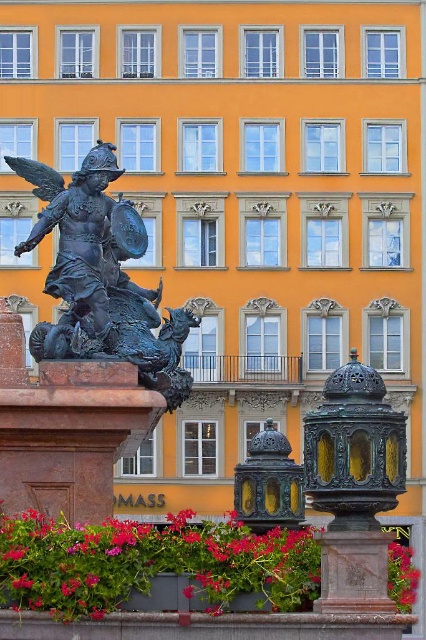
Question: Which object appears farthest from the camera in this image?

Choices:
 (A) bronze statue at left
 (B) vivid pink petals at lower center

Answer: (A)

Question: Does vivid pink petals at lower center have a smaller size compared to vivid red petals at lower right?

Choices:
 (A) yes
 (B) no

Answer: (B)

Question: Which point is closer to the camera?

Choices:
 (A) pyautogui.click(x=51, y=340)
 (B) pyautogui.click(x=414, y=589)
 (C) pyautogui.click(x=391, y=589)

Answer: (C)

Question: Where is bronze statue at left located in relation to vivid red petals at lower right in the image?

Choices:
 (A) below
 (B) above

Answer: (B)

Question: Which point is closer to the camera taking this photo?

Choices:
 (A) (88, 531)
 (B) (100, 250)

Answer: (A)

Question: Can you confirm if vivid pink petals at lower center is positioned below bronze statue at left?

Choices:
 (A) no
 (B) yes

Answer: (B)